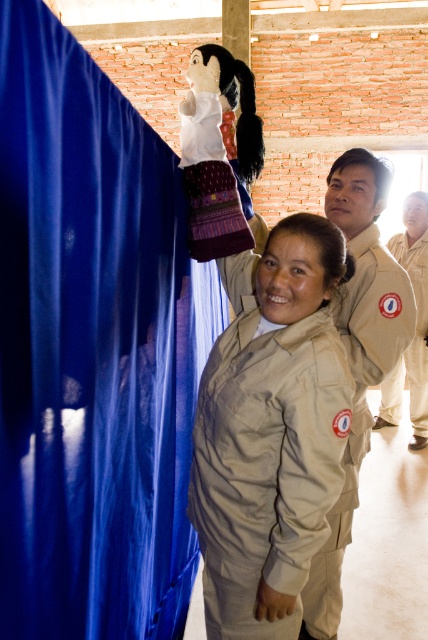
You are a guest at this event and see the blue fabric curtain at left and the beige uniform at center. Which one is located to the left of the other?

The blue fabric curtain at left is positioned on the left side of beige uniform at center.

Based on the photo, you are a visitor in this room and want to take a photo of the beige uniform at center without the blue fabric curtain at left appearing in the shot. Is it possible to position yourself in a way that the curtain is out of frame while still capturing the uniform?

The blue fabric curtain at left is closer to the viewer than the beige uniform at center. By moving to the right side of the room, you can position yourself so that the curtain is out of the frame while still capturing the beige uniform at center in the background.

You are a delivery robot that needs to move from the point at coordinate (x=50, y=358) to the delivery location at coordinate 0.685, 0.234. The maximum distance you can travel is 0.1 meters. Can you reach the delivery location?

The distance between the point at coordinate (x=50, y=358) and the delivery location at coordinate 0.685, 0.234 is 81.92 centimeters, which is 0.8192 meters. Since the maximum distance you can travel is 0.1 meters, you cannot reach the delivery location.